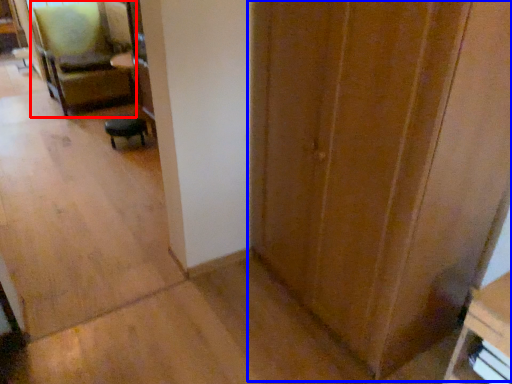
Question: Which object is closer to the camera taking this photo, chair (highlighted by a red box) or door (highlighted by a blue box)?

Choices:
 (A) chair
 (B) door

Answer: (B)